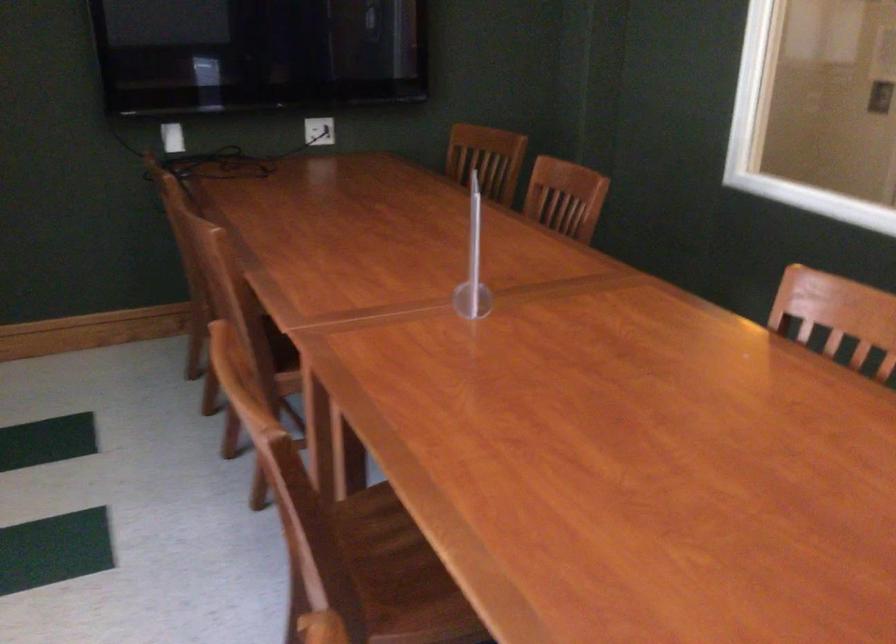
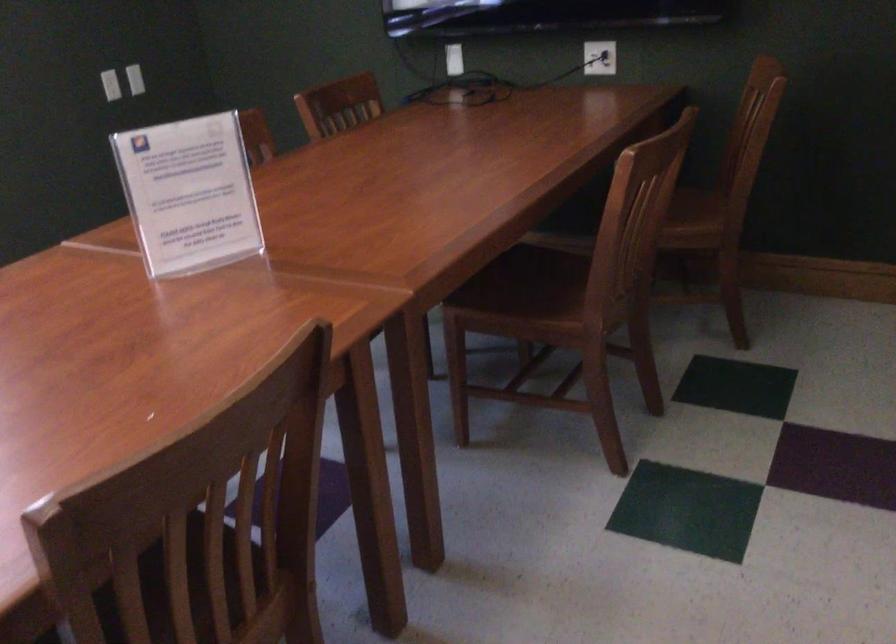
Question: I am providing you with two images of the same scene from different viewpoints. Please identify which objects are invisible in image2.

Choices:
 (A) brown chair sitting surface
 (B) clear sign holder
 (C) detergent box handle
 (D) wooden chair seat

Answer: (D)